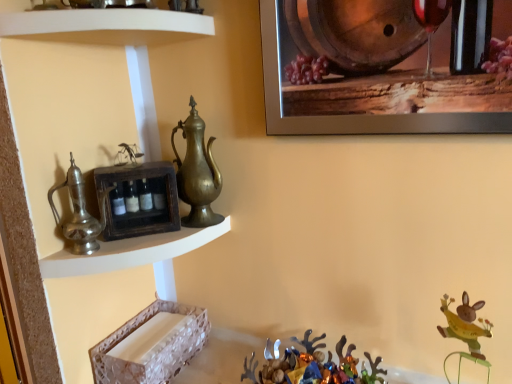
Question: In terms of width, does wooden barrel at upper right look wider or thinner when compared to wooden crate at upper left, which appears as the 3th shelf when ordered from the bottom?

Choices:
 (A) wide
 (B) thin

Answer: (B)

Question: In terms of size, does wooden barrel at upper right appear bigger or smaller than wooden crate at upper left, which appears as the 3th shelf when ordered from the bottom?

Choices:
 (A) small
 (B) big

Answer: (B)

Question: Based on their relative distances, which object is nearer to the brushed metal jug at left, placed as the first jug when sorted from front to back?

Choices:
 (A) metallic silver reindeer at lower center
 (B) white glossy shelf at upper left, which is the first shelf from top to bottom
 (C) wooden crate at upper left, placed as the 2th shelf when sorted from top to bottom
 (D) brass/bronze jug at center, placed as the first jug when sorted from back to front
 (E) white textured tray at lower left, the fourth shelf when ordered from top to bottom

Answer: (C)

Question: Which object is positioned farthest from the wooden barrel at upper right?

Choices:
 (A) white glossy shelf at upper left, marked as the 4th shelf in a bottom-to-top arrangement
 (B) white textured tray at lower left, the 1th shelf positioned from the bottom
 (C) metallic silver reindeer at lower center
 (D) wooden crate at upper left, which appears as the 3th shelf when ordered from the bottom
 (E) brushed metal jug at left, positioned as the second jug in back-to-front order

Answer: (B)